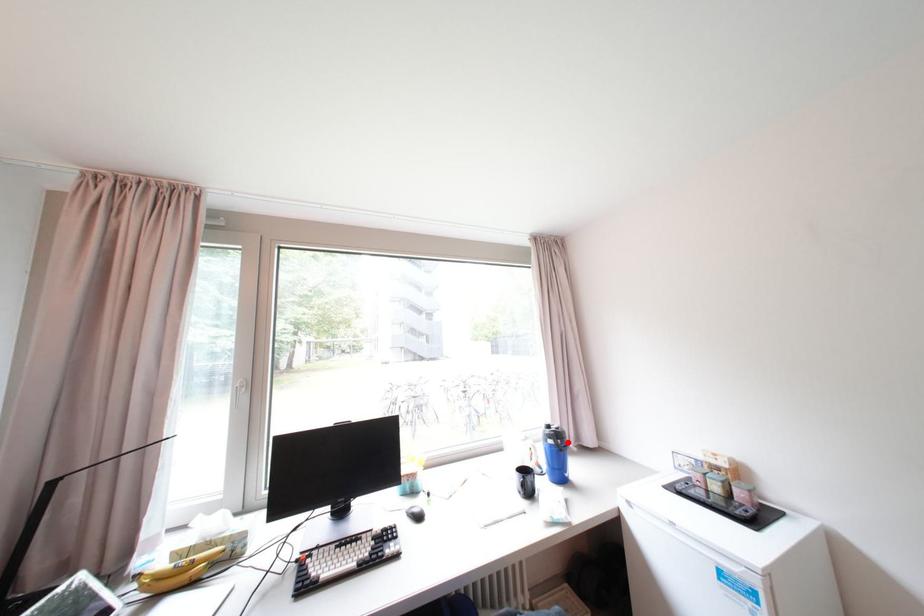
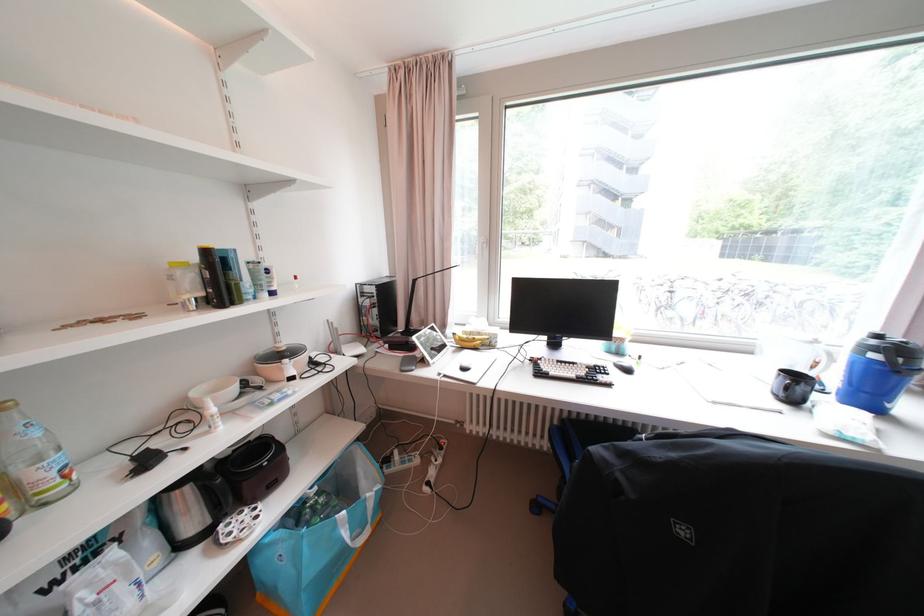
Question: I am providing you with two images of the same scene from different viewpoints. In image1, a red point is highlighted. Considering the same 3D point in image2, which of the following is correct?

Choices:
 (A) It is closer
 (B) It is farther

Answer: (A)